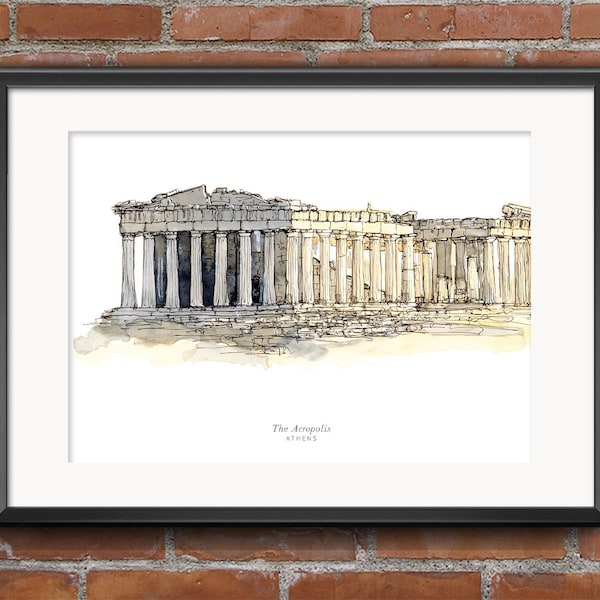
The image size is (600, 600). In order to click on black picture frame, inner corners in this screenshot , I will do `click(7, 86)`, `click(593, 87)`, `click(594, 504)`, `click(7, 504)`.